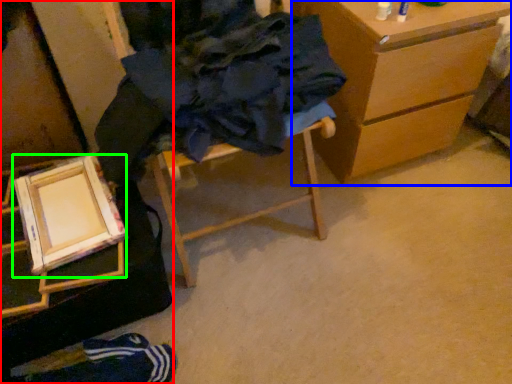
Question: Which is farther away from furniture (highlighted by a red box)? chest of drawers (highlighted by a blue box) or picture frame (highlighted by a green box)?

Choices:
 (A) chest of drawers
 (B) picture frame

Answer: (A)